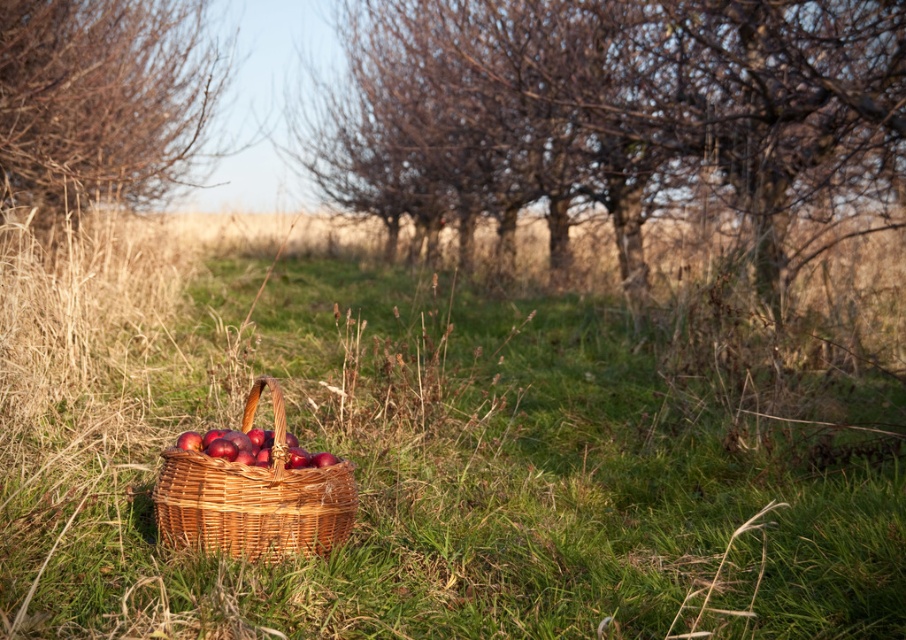
Question: Is woven brown basket at center above shiny red apples at center?

Choices:
 (A) no
 (B) yes

Answer: (A)

Question: Which is farther from the shiny red apples at center?

Choices:
 (A) woven brown basket at center
 (B) brown textured bush at left

Answer: (B)

Question: Which object is the closest to the green grass at center?

Choices:
 (A) shiny red apples at center
 (B) woven brown basket at center

Answer: (B)

Question: Among these points, which one is farthest from the camera?

Choices:
 (A) (22, 84)
 (B) (184, 442)

Answer: (A)

Question: Can you confirm if woven brown basket at center is thinner than shiny red apples at center?

Choices:
 (A) yes
 (B) no

Answer: (B)

Question: Can you confirm if brown textured bush at left is wider than woven brown basket at center?

Choices:
 (A) yes
 (B) no

Answer: (B)